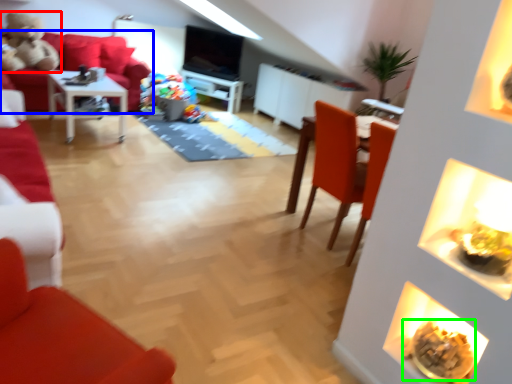
Question: Which object is positioned farthest from toy (highlighted by a red box)? Select from studio couch (highlighted by a blue box) and food (highlighted by a green box).

Choices:
 (A) studio couch
 (B) food

Answer: (B)